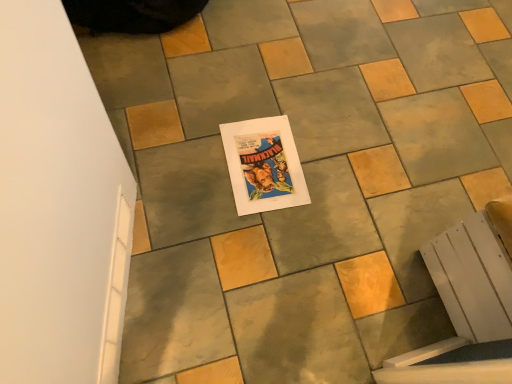
The image size is (512, 384). What are the coordinates of `free space to the left of vibrant paper comic book at center` in the screenshot? It's located at (184, 150).